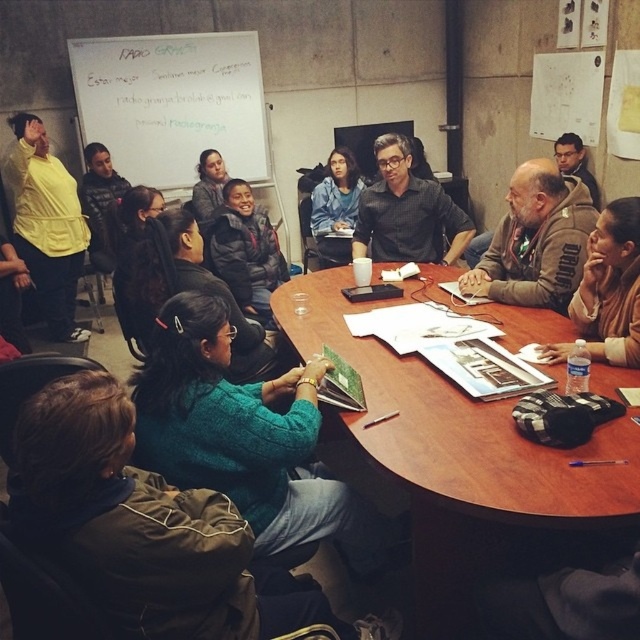
Question: In this image, where is matte yellow shirt at upper left located relative to black matte shirt at center?

Choices:
 (A) right
 (B) left

Answer: (B)

Question: In this image, where is black matte shirt at center located relative to matte blue sweater at center?

Choices:
 (A) right
 (B) left

Answer: (A)

Question: Which of the following is the closest to the observer?

Choices:
 (A) matte blue sweater at center
 (B) brown leather jacket at lower right

Answer: (B)

Question: Is the position of matte yellow shirt at upper left more distant than that of brown leather jacket at lower right?

Choices:
 (A) yes
 (B) no

Answer: (A)

Question: Among these objects, which one is nearest to the camera?

Choices:
 (A) matte blue sweater at center
 (B) teal sweater at center
 (C) matte yellow shirt at upper left

Answer: (B)

Question: Which object is positioned closest to the matte yellow shirt at upper left?

Choices:
 (A) matte blue sweater at center
 (B) teal sweater at center

Answer: (A)